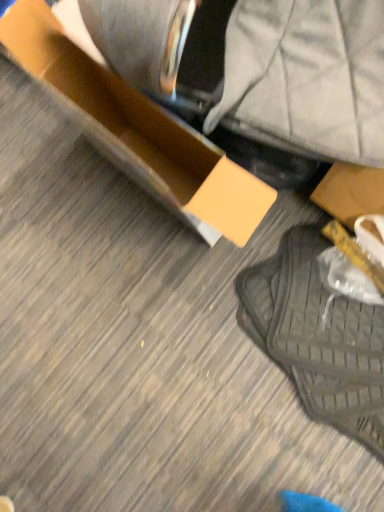
The height and width of the screenshot is (512, 384). I want to click on vacant space underneath black mesh bag at lower right (from a real-world perspective), so coord(312,352).